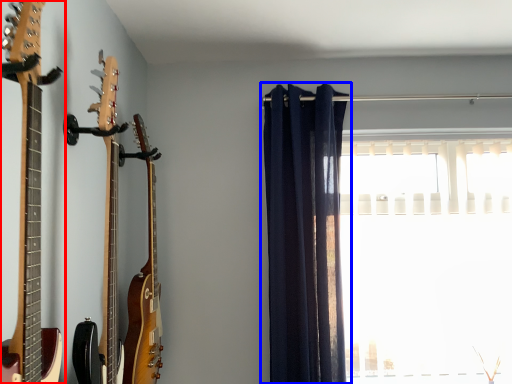
Question: Among these objects, which one is farthest to the camera, guitar (highlighted by a red box) or curtain (highlighted by a blue box)?

Choices:
 (A) guitar
 (B) curtain

Answer: (B)